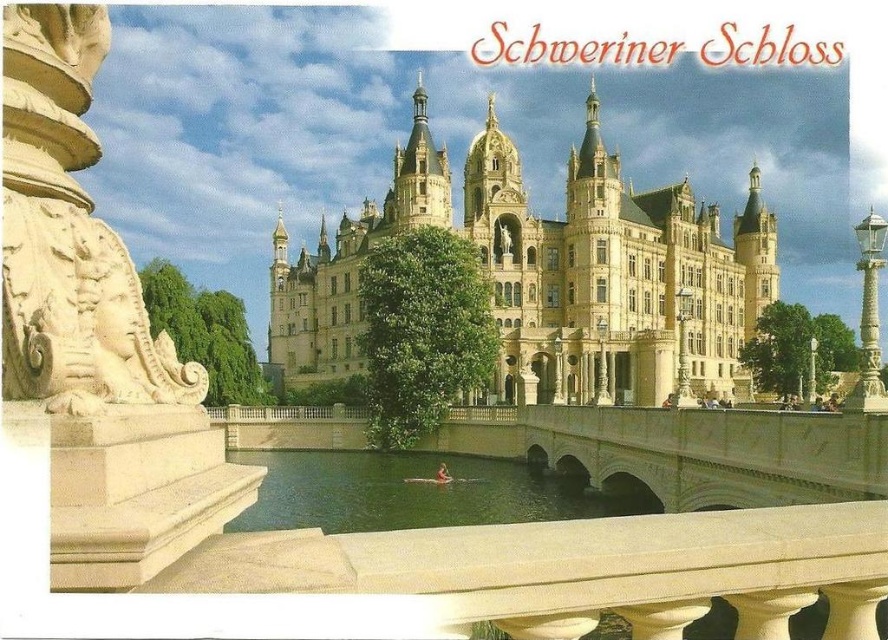
Can you confirm if yellow stone castle at center is wider than green water at center?

Indeed, yellow stone castle at center has a greater width compared to green water at center.

Who is higher up, yellow stone castle at center or green water at center?

Positioned higher is yellow stone castle at center.

Locate an element on the screen. The height and width of the screenshot is (640, 888). yellow stone castle at center is located at coordinates (546, 273).

At what (x,y) coordinates should I click in order to perform the action: click on yellow stone castle at center. Please return your answer as a coordinate pair (x, y). The image size is (888, 640). Looking at the image, I should click on (546, 273).